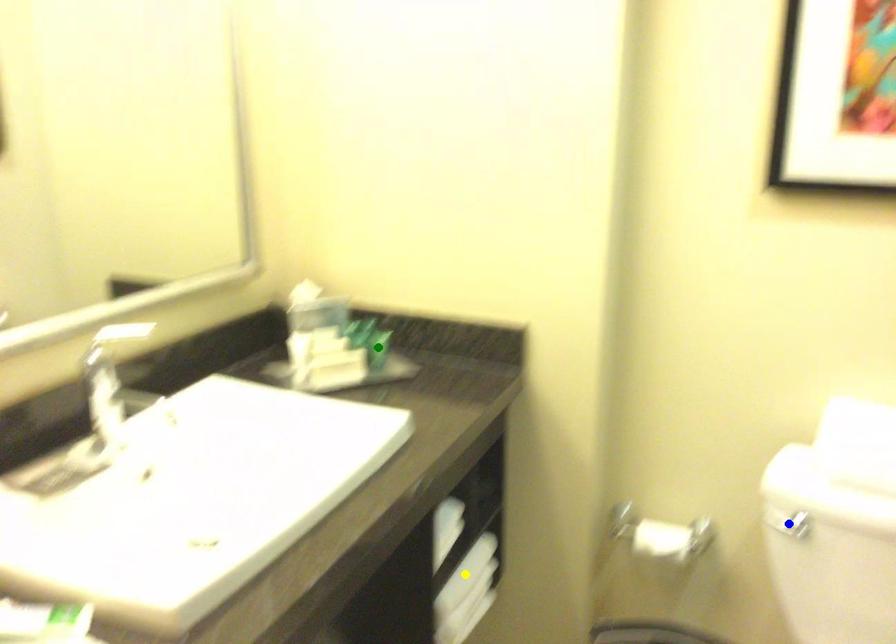
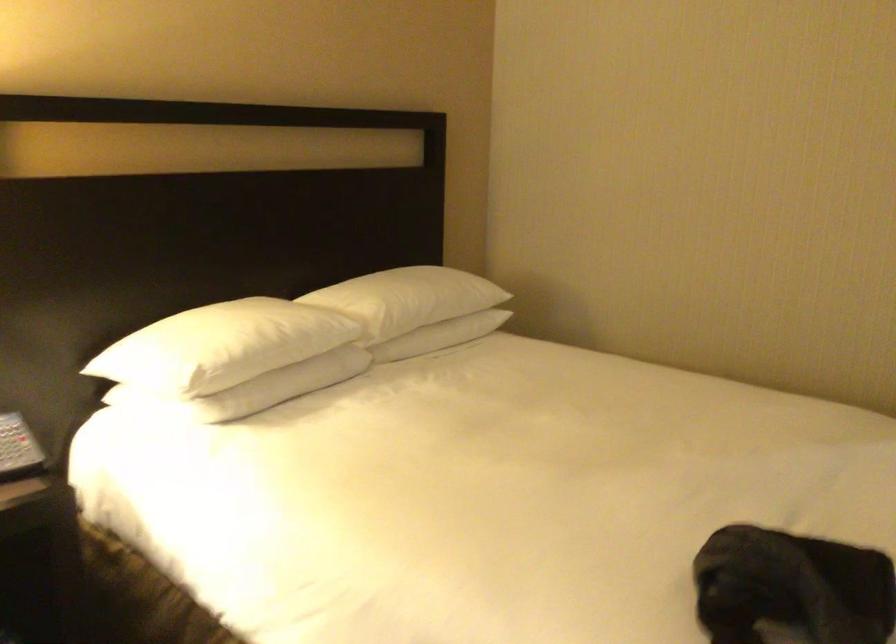
I am providing you with two images of the same scene from different viewpoints. Three points are marked in image1. Which point corresponds to a part or object that is occluded in image2?In image1, three points are marked. Which of them correspond to a part or object that is occluded in image2?Among the three points shown in image1, which one corresponds to a part or object that is no longer visible due to occlusion in image2?

Invisible in image2: green point, blue point, yellow point.